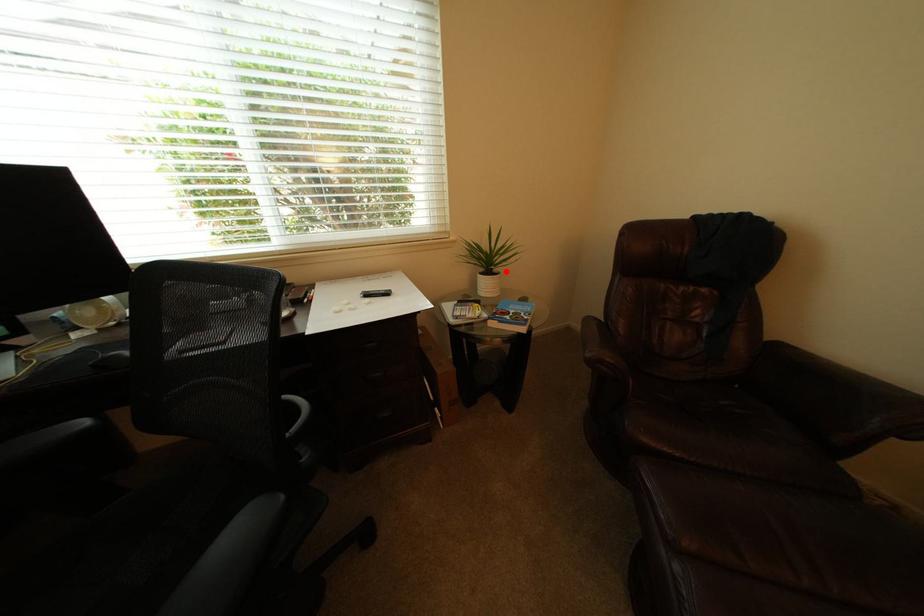
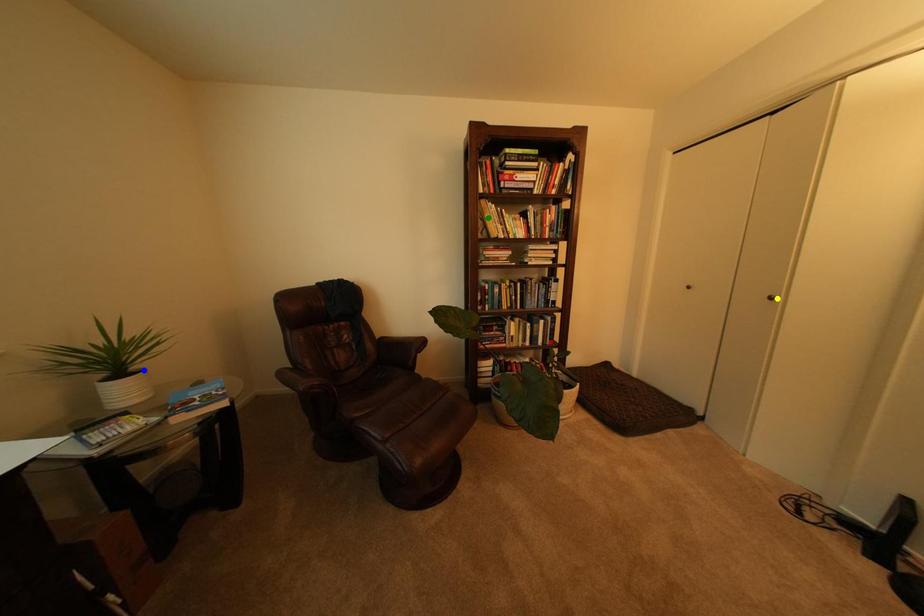
Question: I am providing you with two images of the same scene from different viewpoints. A red point is marked on the first image. You are given multiple points on the second image. Which mark in image 2 goes with the point in image 1?

Choices:
 (A) yellow point
 (B) green point
 (C) blue point

Answer: (C)